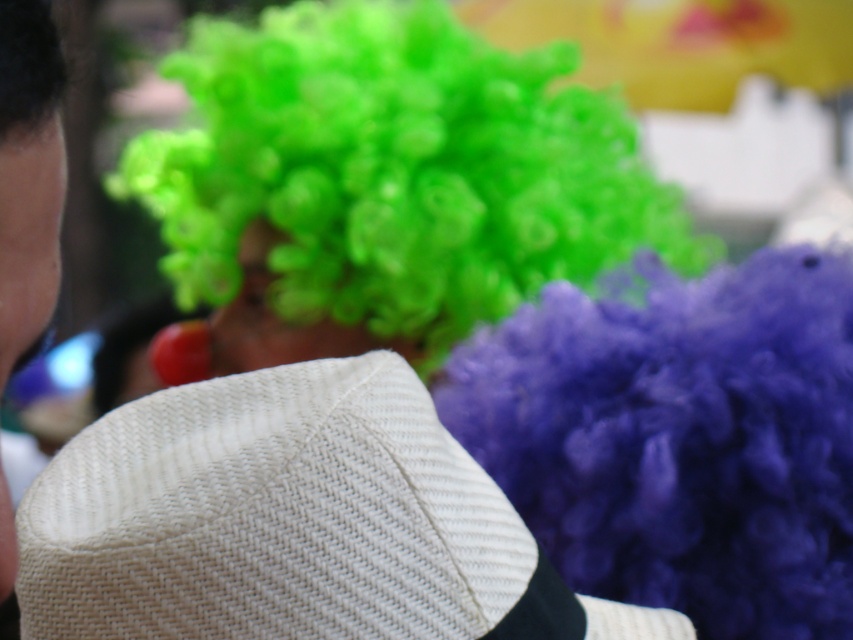
Between white woven straw hat at center and white woven hat at left, which one appears on the left side from the viewer's perspective?

Positioned to the left is white woven hat at left.

Can you confirm if white woven straw hat at center is shorter than white woven hat at left?

Yes.

Measure the distance between point (x=399, y=458) and camera.

The distance of point (x=399, y=458) from camera is 1.18 meters.

Find the location of a particular element. The width and height of the screenshot is (853, 640). white woven straw hat at center is located at coordinates (289, 522).